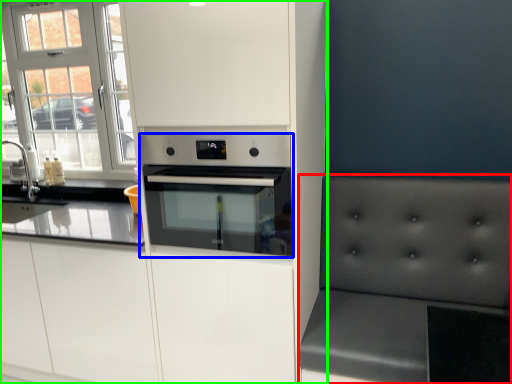
Question: Considering the real-world distances, which object is closest to armchair (highlighted by a red box)? home appliance (highlighted by a blue box) or cabinetry (highlighted by a green box).

Choices:
 (A) home appliance
 (B) cabinetry

Answer: (A)